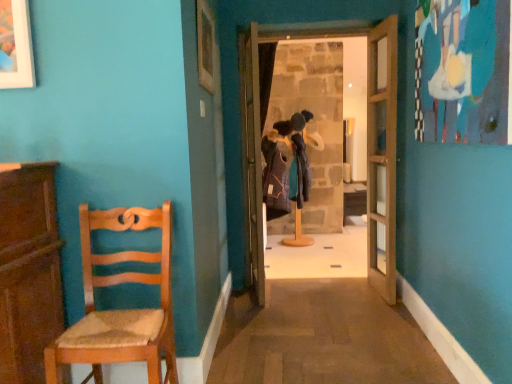
Question: From the image's perspective, relative to wooden picture frame at upper center, is wooden table at center above or below?

Choices:
 (A) above
 (B) below

Answer: (B)

Question: Considering the positions of wooden table at center and wooden picture frame at upper center in the image, is wooden table at center bigger or smaller than wooden picture frame at upper center?

Choices:
 (A) big
 (B) small

Answer: (A)

Question: Which object is positioned farthest from the wooden coat rack at center, which is the third door in right-to-left order?

Choices:
 (A) woven wood chair at left
 (B) wooden door at center, placed as the third door when sorted from left to right
 (C) wooden picture frame at upper center
 (D) wooden table at center
 (E) wooden coat rack at center, which is the second door in right-to-left order

Answer: (D)

Question: Estimate the real-world distances between objects in this image. Which object is farther from the wooden coat rack at center, which appears as the first door when viewed from the left?

Choices:
 (A) wooden coat rack at center, which is counted as the second door, starting from the left
 (B) wooden door at center, the 1th door from the right
 (C) woven wood chair at left
 (D) wooden picture frame at upper center
 (E) wooden table at center

Answer: (E)